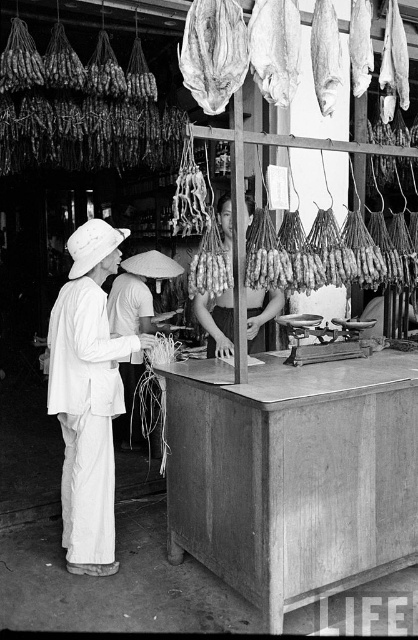
You are standing at the vendor stall in the market. You see two points marked on the counter. The first point is at coordinate point (274,92) and the second is at point (231,323). If you are facing the counter, which point is closer to you?

Point (274,92) is in front of point (231,323), so if you are facing the counter, point (274,92) is closer to you.

You are a customer at the market stall. You see the dried fish at upper center and the white fabric apron at center. Which item is smaller in size?

The dried fish at upper center is smaller than the white fabric apron at center.